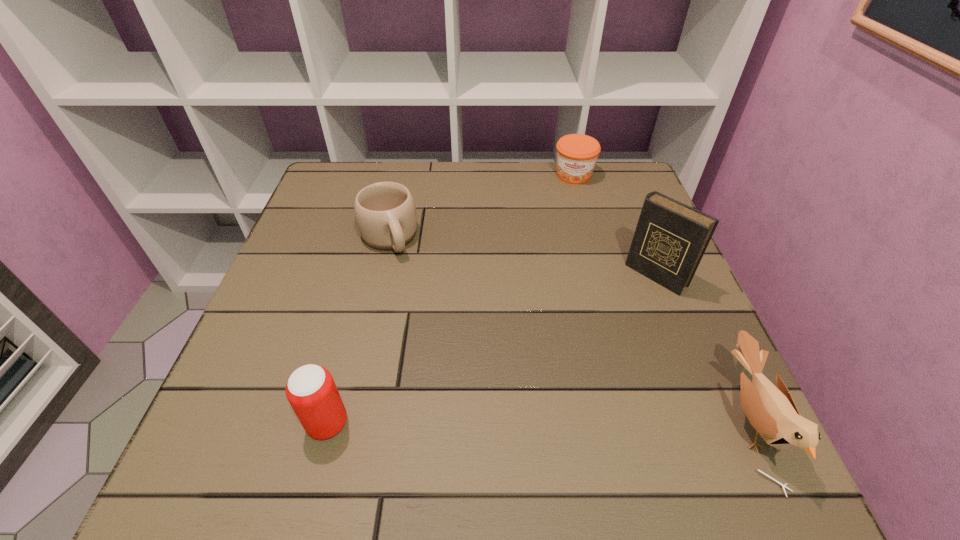
Identify the location of beer can. (311, 391).

Where is `bird`? bird is located at coordinates (772, 412).

Find the location of a particular element. diary is located at coordinates (670, 239).

Locate an element on the screen. mug is located at coordinates (385, 212).

What are the coordinates of `jam` in the screenshot? It's located at (577, 154).

You are a GUI agent. You are given a task and a screenshot of the screen. Output one action in this format:
    pyautogui.click(x=<x>, y=<y>)
    Task: Click on the farthest object
    
    Given the screenshot: What is the action you would take?
    pyautogui.click(x=577, y=154)

At what (x,y) coordinates should I click in order to perform the action: click on vacant space positioned 0.150m on the right of the beer can. Please return your answer as a coordinate pair (x, y). The width and height of the screenshot is (960, 540). Looking at the image, I should click on (439, 423).

At what (x,y) coordinates should I click in order to perform the action: click on blank space located 0.400m at the beak of the bird. Please return your answer as a coordinate pair (x, y). The image size is (960, 540). Looking at the image, I should click on (487, 421).

Image resolution: width=960 pixels, height=540 pixels. In order to click on free spot located 0.170m at the beak of the bird in this screenshot , I will do `click(626, 421)`.

Image resolution: width=960 pixels, height=540 pixels. I want to click on vacant space located at the beak of the bird, so click(662, 421).